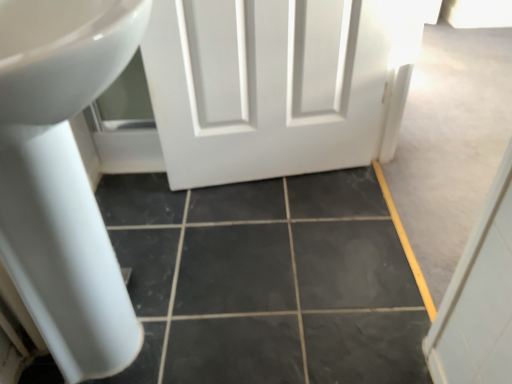
Where is `white glossy sink at left`? The image size is (512, 384). white glossy sink at left is located at coordinates (63, 177).

What do you see at coordinates (63, 177) in the screenshot?
I see `white glossy sink at left` at bounding box center [63, 177].

What do you see at coordinates (267, 281) in the screenshot?
I see `black marble tile at center` at bounding box center [267, 281].

This screenshot has height=384, width=512. Find the location of `black marble tile at center`. black marble tile at center is located at coordinates (267, 281).

You are a GUI agent. You are given a task and a screenshot of the screen. Output one action in this format:
    pyautogui.click(x=<x>, y=<y>)
    Task: Click on the white glossy sink at left
    This screenshot has width=512, height=384.
    Given the screenshot: What is the action you would take?
    pyautogui.click(x=63, y=177)

In the image, is black marble tile at center on the left side or the right side of white glossy sink at left?

From the image, it's evident that black marble tile at center is to the right of white glossy sink at left.

Which object is closer to the camera, black marble tile at center or white glossy sink at left?

white glossy sink at left is closer to the camera.

Which is behind, point (218, 369) or point (55, 237)?

Point (218, 369)

From the image's perspective, which is below, black marble tile at center or white glossy sink at left?

black marble tile at center.

From a real-world perspective, relative to white glossy sink at left, is black marble tile at center vertically above or below?

black marble tile at center is below white glossy sink at left.

Looking at this image, is black marble tile at center wider than white glossy sink at left?

Correct, the width of black marble tile at center exceeds that of white glossy sink at left.

Consider the image. Who is shorter, black marble tile at center or white glossy sink at left?

black marble tile at center.

Considering the sizes of objects black marble tile at center and white glossy sink at left in the image provided, who is bigger, black marble tile at center or white glossy sink at left?

With larger size is white glossy sink at left.

Is black marble tile at center not within white glossy sink at left?

black marble tile at center is positioned outside white glossy sink at left.

Is black marble tile at center beside white glossy sink at left?

No, black marble tile at center is not making contact with white glossy sink at left.

Based on the photo, does black marble tile at center turn towards white glossy sink at left?

No, black marble tile at center is not facing towards white glossy sink at left.

Can you tell me how much black marble tile at center and white glossy sink at left differ in facing direction?

The angle between the facing direction of black marble tile at center and the facing direction of white glossy sink at left is 1.3 degrees.

The width and height of the screenshot is (512, 384). Identify the location of sink above the black marble tile at center (from the image's perspective). [x=63, y=177].

Is white glossy sink at left to the left or to the right of black marble tile at center in the image?

white glossy sink at left is positioned on black marble tile at center's left side.

Between white glossy sink at left and black marble tile at center, which one is positioned in front?

Positioned in front is white glossy sink at left.

Is point (42, 28) more distant than point (403, 252)?

No.

From the image's perspective, which is above, white glossy sink at left or black marble tile at center?

white glossy sink at left.

From a real-world perspective, is white glossy sink at left under black marble tile at center?

Actually, white glossy sink at left is physically above black marble tile at center in the real world.

Can you confirm if white glossy sink at left is wider than black marble tile at center?

In fact, white glossy sink at left might be narrower than black marble tile at center.

Considering the sizes of objects white glossy sink at left and black marble tile at center in the image provided, who is taller, white glossy sink at left or black marble tile at center?

Standing taller between the two is white glossy sink at left.

Between white glossy sink at left and black marble tile at center, which one has smaller size?

Smaller between the two is black marble tile at center.

Is white glossy sink at left inside or outside of black marble tile at center?

white glossy sink at left cannot be found inside black marble tile at center.

Would you consider white glossy sink at left to be distant from black marble tile at center?

Actually, white glossy sink at left and black marble tile at center are a little close together.

Could you tell me if white glossy sink at left is facing black marble tile at center?

No, white glossy sink at left is not aimed at black marble tile at center.

How different are the orientations of white glossy sink at left and black marble tile at center in degrees?

1.3 degrees.

This screenshot has width=512, height=384. In order to click on sink on the left of black marble tile at center in this screenshot , I will do `click(63, 177)`.

You are a GUI agent. You are given a task and a screenshot of the screen. Output one action in this format:
    pyautogui.click(x=<x>, y=<y>)
    Task: Click on the ceramic tile located on the right of white glossy sink at left
    
    Given the screenshot: What is the action you would take?
    pyautogui.click(x=267, y=281)

In the image, there is a black marble tile at center. Where is `sink above it (from the image's perspective)`? The width and height of the screenshot is (512, 384). sink above it (from the image's perspective) is located at coordinates (63, 177).